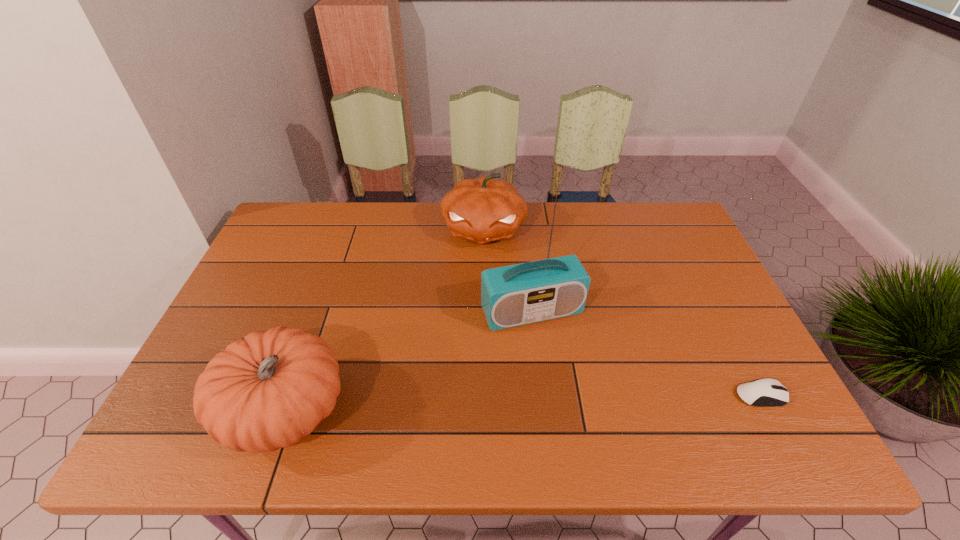
This screenshot has width=960, height=540. In order to click on the left pumpkin in this screenshot , I will do `click(269, 389)`.

Find the location of a particular element. The image size is (960, 540). the nearer pumpkin is located at coordinates point(269,389).

Image resolution: width=960 pixels, height=540 pixels. Identify the location of mouse. 767,392.

Where is `the rightmost object`? the rightmost object is located at coordinates (767, 392).

Locate an element on the screen. This screenshot has height=540, width=960. the right pumpkin is located at coordinates (484, 209).

Find the location of a particular element. This screenshot has height=540, width=960. the farther pumpkin is located at coordinates (484, 209).

Find the location of a particular element. This screenshot has height=540, width=960. the tallest object is located at coordinates (525, 293).

Find the location of a particular element. Image resolution: width=960 pixels, height=540 pixels. the second farthest object is located at coordinates (525, 293).

Identify the location of free space located on the back of the nearer pumpkin. The height and width of the screenshot is (540, 960). (313, 332).

What are the coordinates of `free space located 0.080m on the back of the rightmost object` in the screenshot? It's located at (740, 356).